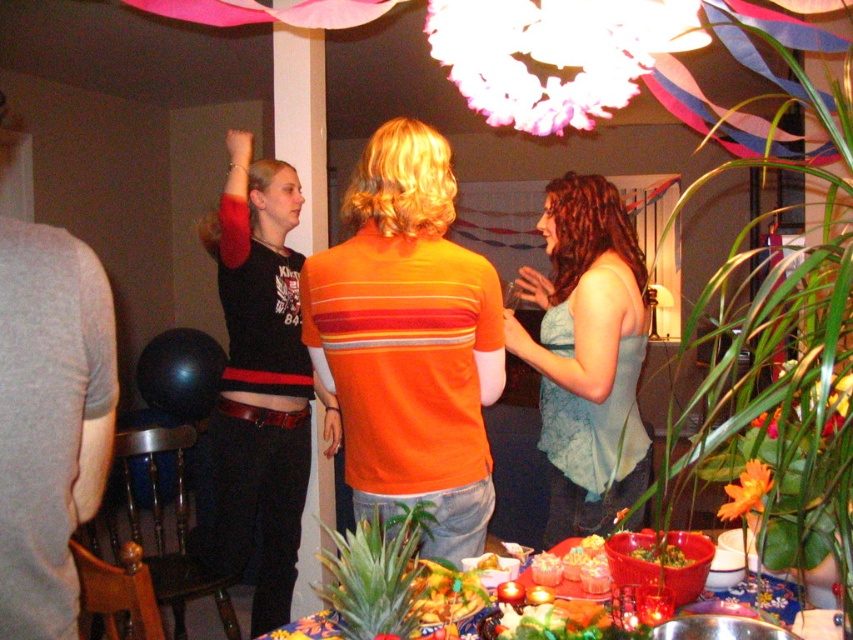
Can you confirm if gray cotton t-shirt at left is taller than smooth red bowl at center?

Yes, gray cotton t-shirt at left is taller than smooth red bowl at center.

Between point (4, 259) and point (685, 564), which one is positioned in front?

Point (4, 259) is more forward.

Locate an element on the screen. Image resolution: width=853 pixels, height=640 pixels. gray cotton t-shirt at left is located at coordinates coord(48,419).

Does gray cotton t-shirt at left appear on the left side of yellow matte pineapple at center?

Correct, you'll find gray cotton t-shirt at left to the left of yellow matte pineapple at center.

Does gray cotton t-shirt at left have a smaller size compared to yellow matte pineapple at center?

Incorrect, gray cotton t-shirt at left is not smaller in size than yellow matte pineapple at center.

Who is more distant from viewer, (62, 444) or (490, 566)?

Point (490, 566)

This screenshot has width=853, height=640. I want to click on gray cotton t-shirt at left, so click(48, 419).

Is matte black shirt at upper left below blue satin dress at center?

Correct, matte black shirt at upper left is located below blue satin dress at center.

This screenshot has height=640, width=853. I want to click on matte black shirt at upper left, so click(x=258, y=385).